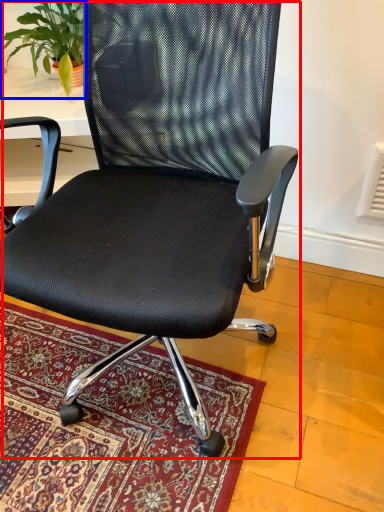
Question: Among these objects, which one is nearest to the camera, chair (highlighted by a red box) or houseplant (highlighted by a blue box)?

Choices:
 (A) chair
 (B) houseplant

Answer: (A)